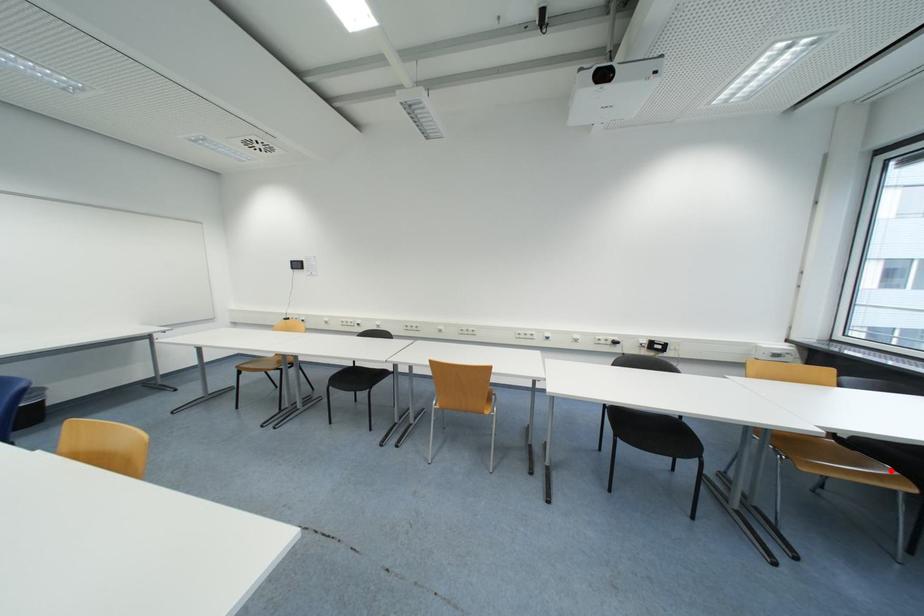
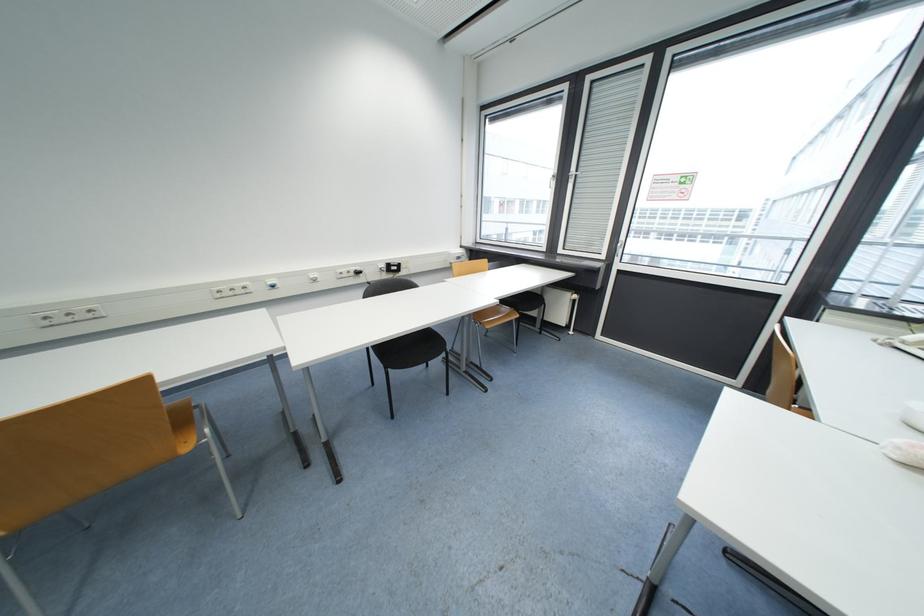
In the second image, find the point that corresponds to the highlighted location in the first image.

(512, 310)